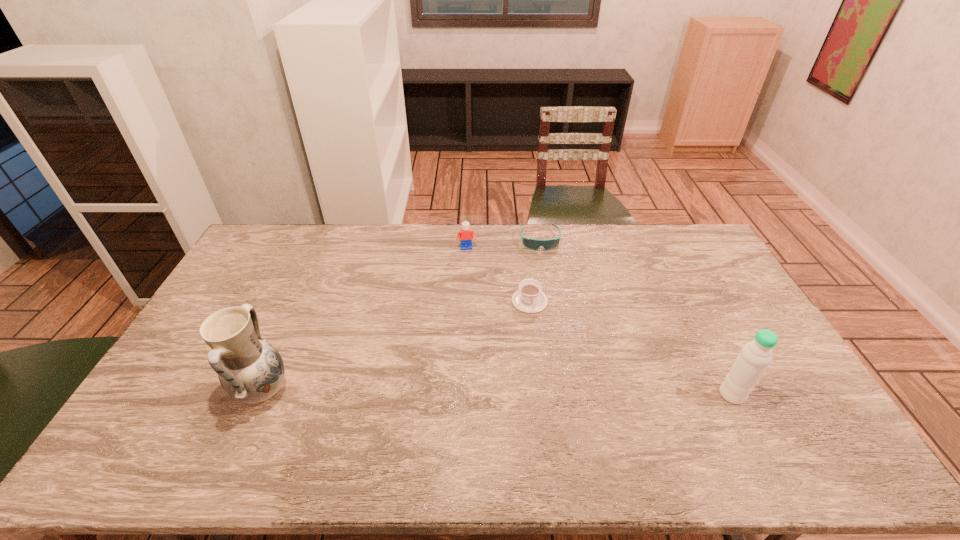
At what (x,y) coordinates should I click in order to perform the action: click on free space located on the handle side of the teacup. Please return your answer as a coordinate pair (x, y). The width and height of the screenshot is (960, 540). Looking at the image, I should click on (536, 330).

What are the coordinates of `vacant space located 0.360m on the handle side of the teacup` in the screenshot? It's located at (551, 412).

The width and height of the screenshot is (960, 540). I want to click on free space located on the face of the Lego, so click(x=480, y=305).

Locate an element on the screen. The height and width of the screenshot is (540, 960). vacant space located on the face of the Lego is located at coordinates (483, 316).

At what (x,y) coordinates should I click in order to perform the action: click on vacant space situated 0.320m on the face of the Lego. Please return your answer as a coordinate pair (x, y). The width and height of the screenshot is (960, 540). Looking at the image, I should click on (481, 309).

Image resolution: width=960 pixels, height=540 pixels. Identify the location of free space located 0.260m on the front-facing side of the sunglasses. (547, 300).

Locate an element on the screen. This screenshot has width=960, height=540. vacant space situated 0.100m on the front-facing side of the sunglasses is located at coordinates (543, 269).

Where is `free space located 0.170m on the front-facing side of the sunglasses`? Image resolution: width=960 pixels, height=540 pixels. free space located 0.170m on the front-facing side of the sunglasses is located at coordinates (544, 282).

Locate an element on the screen. Lego at the far edge is located at coordinates (466, 235).

The image size is (960, 540). I want to click on sunglasses at the far edge, so click(534, 244).